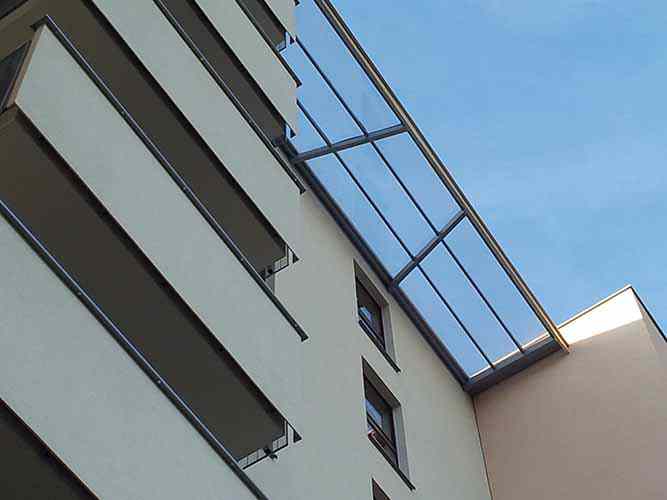
Find the location of a particular element. The width and height of the screenshot is (667, 500). security camera is located at coordinates (265, 452).